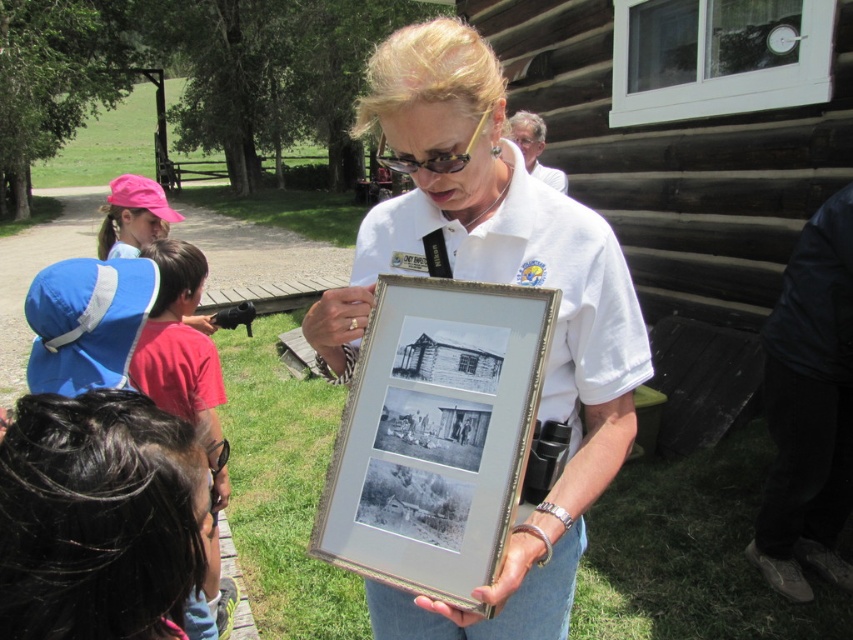
Does black hair at lower left come in front of dark blue leather jacket at lower right?

Yes, it is.

Is black hair at lower left taller than dark blue leather jacket at lower right?

No.

At what (x,y) coordinates should I click in order to perform the action: click on black hair at lower left. Please return your answer as a coordinate pair (x, y). Looking at the image, I should click on (97, 518).

Where is `black hair at lower left`? The width and height of the screenshot is (853, 640). black hair at lower left is located at coordinates (97, 518).

Consider the image. Can you confirm if metallic frame at center is bigger than silver/golden metallic picture frame at center?

Indeed, metallic frame at center has a larger size compared to silver/golden metallic picture frame at center.

Is point (479, 36) less distant than point (341, 532)?

No, (479, 36) is further to viewer.

At what (x,y) coordinates should I click in order to perform the action: click on metallic frame at center. Please return your answer as a coordinate pair (x, y). The width and height of the screenshot is (853, 640). Looking at the image, I should click on (492, 282).

Locate an element on the screen. The width and height of the screenshot is (853, 640). dark blue leather jacket at lower right is located at coordinates (809, 406).

Is dark blue leather jacket at lower right wider than pink fabric cap at upper left?

Incorrect, dark blue leather jacket at lower right's width does not surpass pink fabric cap at upper left's.

Between point (775, 467) and point (107, 216), which one is positioned behind?

Positioned behind is point (107, 216).

Identify the location of dark blue leather jacket at lower right. (809, 406).